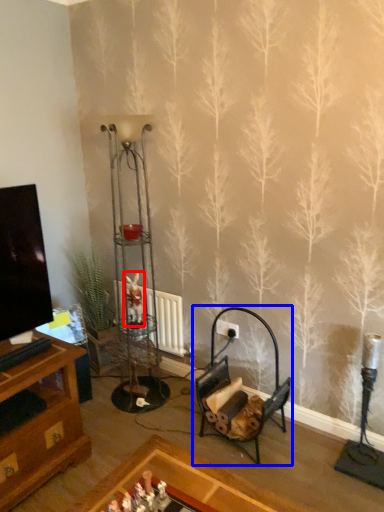
Question: Which object is further to the camera taking this photo, toy (highlighted by a red box) or rocking chair (highlighted by a blue box)?

Choices:
 (A) toy
 (B) rocking chair

Answer: (A)